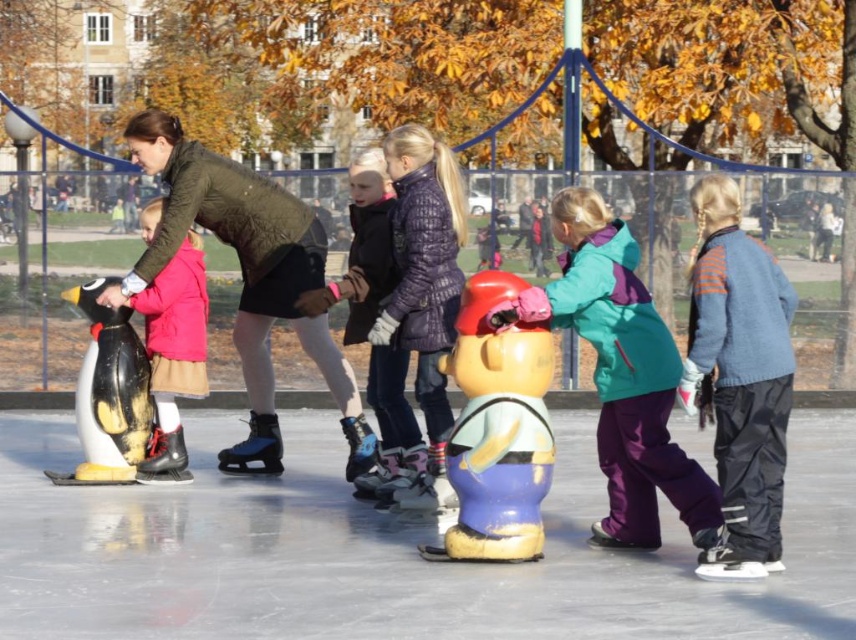
Question: Can you confirm if blue rubber figure at center is bigger than white matte penguin at left?

Choices:
 (A) no
 (B) yes

Answer: (A)

Question: Which point appears closest to the camera in this image?

Choices:
 (A) (164, 272)
 (B) (97, 456)
 (C) (519, 401)
 (D) (395, 444)

Answer: (C)

Question: Which point is closer to the camera taking this photo?

Choices:
 (A) (471, 321)
 (B) (690, 513)
 (C) (361, 285)

Answer: (B)

Question: Can you confirm if blue rubber figure at center is positioned above matte purple jacket at center?

Choices:
 (A) yes
 (B) no

Answer: (B)

Question: Considering the relative positions of teal fleece jacket at center and white matte penguin at left in the image provided, where is teal fleece jacket at center located with respect to white matte penguin at left?

Choices:
 (A) above
 (B) below

Answer: (A)

Question: Which object is closer to the camera taking this photo?

Choices:
 (A) white matte penguin at left
 (B) green quilted jacket at center
 (C) teal fleece jacket at center
 (D) blue rubber figure at center

Answer: (C)